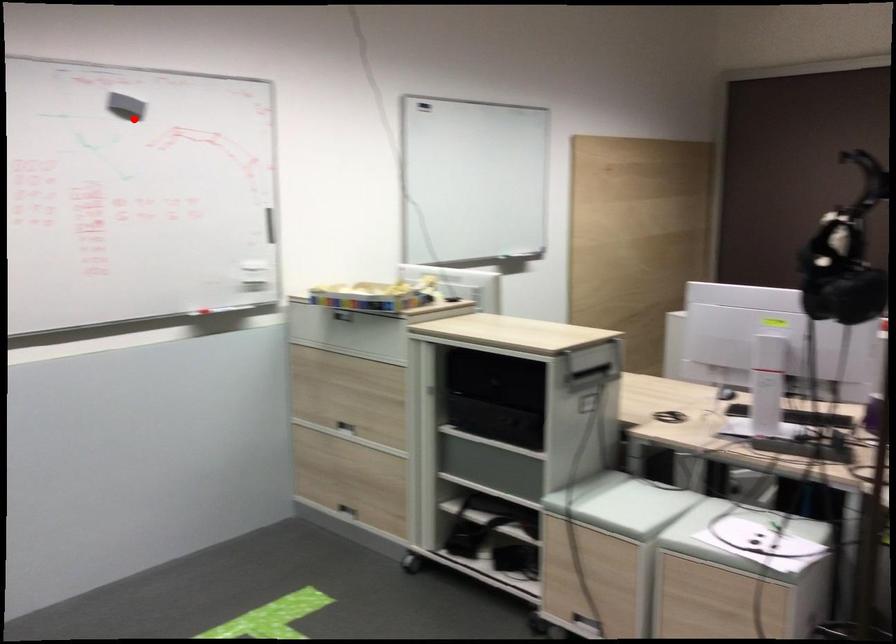
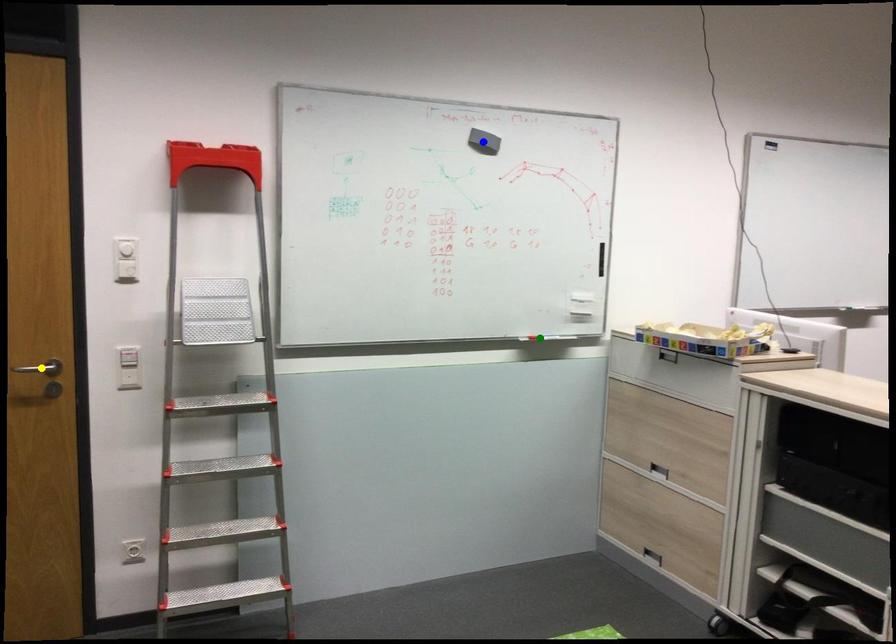
Question: I am providing you with two images of the same scene from different viewpoints. A red point is marked on the first image. You are given multiple points on the second image. Which point in image 2 represents the same 3d spot as the red point in image 1?

Choices:
 (A) green point
 (B) yellow point
 (C) blue point

Answer: (C)